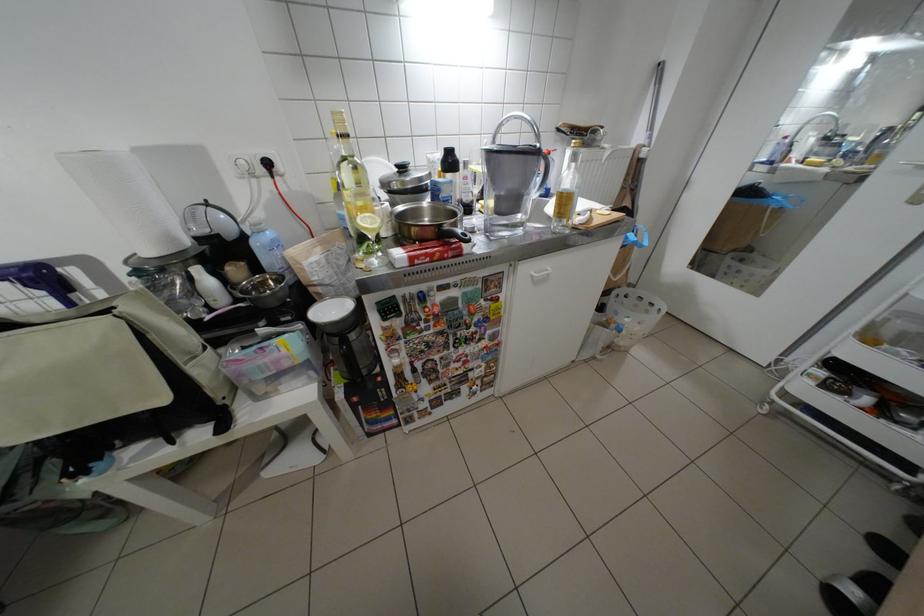
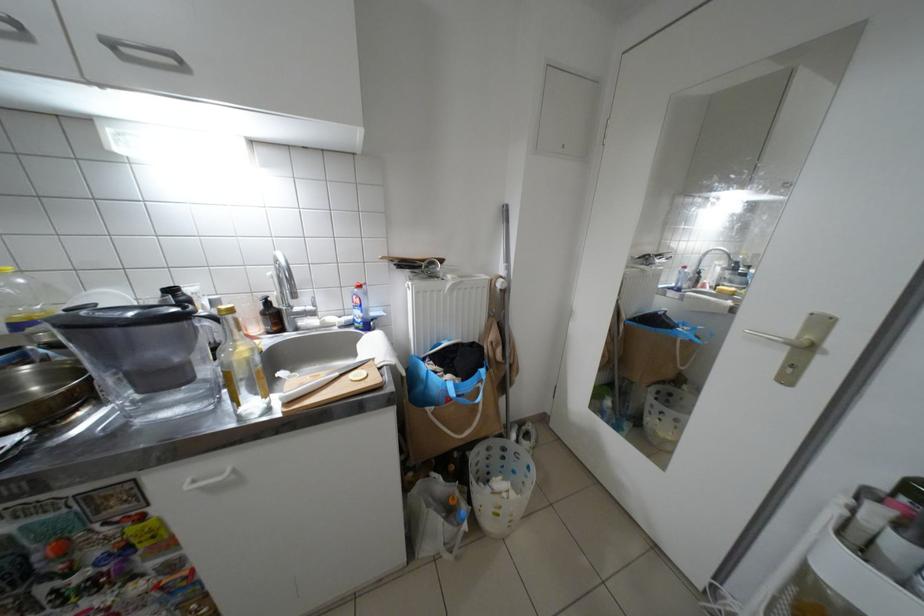
Where in the second image is the point corresponding to pixel 515 195 from the first image?

(139, 369)